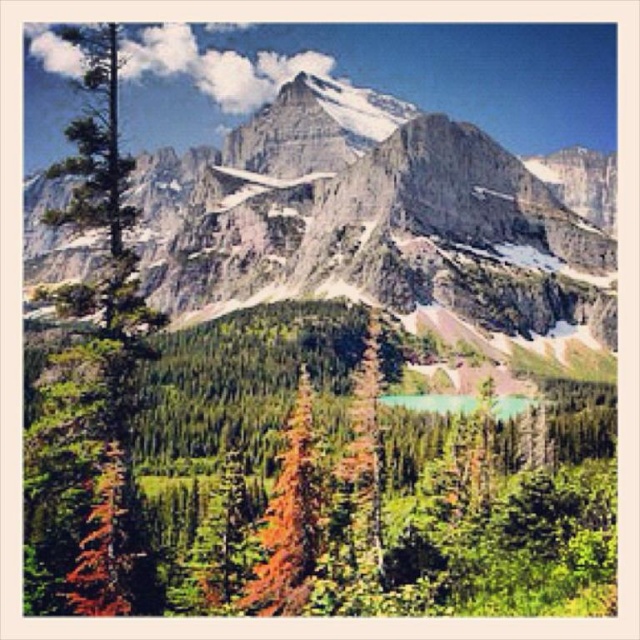
Is orange-brown bark tree at center wider than green glassy lake at center?

No.

Is orange-brown bark tree at center to the left of green glassy lake at center from the viewer's perspective?

Correct, you'll find orange-brown bark tree at center to the left of green glassy lake at center.

In order to click on orange-brown bark tree at center in this screenshot , I will do [289, 516].

Does green matte tree at center have a greater height compared to green glassy lake at center?

Indeed, green matte tree at center has a greater height compared to green glassy lake at center.

Is point (372, 317) positioned before point (445, 400)?

No, (372, 317) is behind (445, 400).

Where is `green matte tree at center`? green matte tree at center is located at coordinates (364, 460).

Who is higher up, green matte tree at left or green glassy lake at center?

green matte tree at left

Is green matte tree at left positioned in front of green glassy lake at center?

Yes, it is in front of green glassy lake at center.

Locate an element on the screen. This screenshot has width=640, height=640. green matte tree at left is located at coordinates (92, 376).